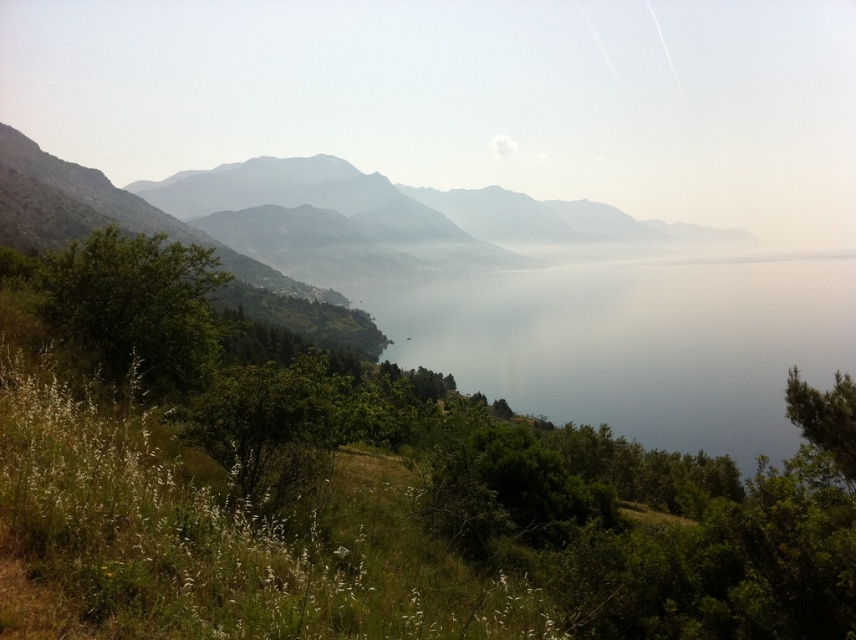
From the picture: Can you confirm if green leafy tree at lower left is positioned above green leafy tree at lower right?

No, green leafy tree at lower left is not above green leafy tree at lower right.

Measure the distance from green leafy tree at lower left to green leafy tree at lower right.

green leafy tree at lower left and green leafy tree at lower right are 20.31 meters apart.

Does point (575, 564) come closer to viewer compared to point (825, 435)?

Yes, point (575, 564) is in front of point (825, 435).

At what (x,y) coordinates should I click in order to perform the action: click on green leafy tree at lower left. Please return your answer as a coordinate pair (x, y). Looking at the image, I should click on (363, 490).

Can you confirm if transparent water at center is shorter than green leafy tree at lower right?

No, transparent water at center is not shorter than green leafy tree at lower right.

Does transparent water at center have a larger size compared to green leafy tree at lower right?

Yes.

Between point (444, 316) and point (827, 390), which one is positioned in front?

Point (827, 390) is more forward.

This screenshot has width=856, height=640. Find the location of `transparent water at center`. transparent water at center is located at coordinates (635, 342).

Does transparent water at center appear on the right side of green leafy tree at left?

Yes, transparent water at center is to the right of green leafy tree at left.

Is transparent water at center wider than green leafy tree at left?

Correct, the width of transparent water at center exceeds that of green leafy tree at left.

Is point (587, 413) in front of point (175, 253)?

No, it is behind (175, 253).

Where is `transparent water at center`? This screenshot has height=640, width=856. transparent water at center is located at coordinates (635, 342).